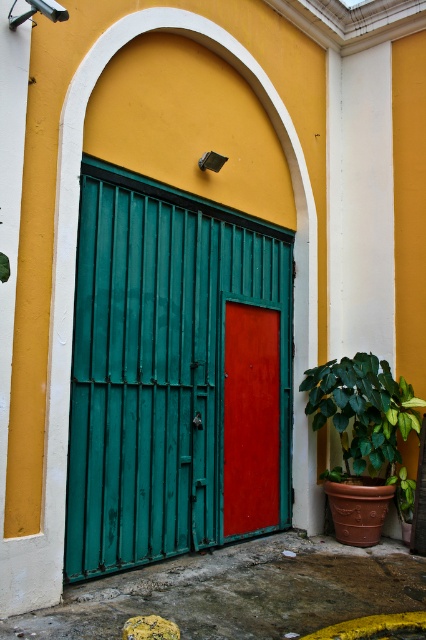
Question: Does green metal/glass door at center appear under green glossy leafy plant at lower right?

Choices:
 (A) yes
 (B) no

Answer: (B)

Question: Among these points, which one is nearest to the camera?

Choices:
 (A) (351, 452)
 (B) (176, 444)
 (C) (259, 445)

Answer: (B)

Question: Which point is closer to the camera?

Choices:
 (A) (241, 500)
 (B) (340, 477)
 (C) (256, 448)

Answer: (A)

Question: Based on their relative distances, which object is farther from the smooth glossy red door at center?

Choices:
 (A) green glossy leafy plant at lower right
 (B) green metal/glass door at center

Answer: (A)

Question: Is green metal/glass door at center to the right of smooth glossy red door at center from the viewer's perspective?

Choices:
 (A) no
 (B) yes

Answer: (A)

Question: Can you confirm if green metal/glass door at center is positioned to the left of green glossy leafy plant at lower right?

Choices:
 (A) yes
 (B) no

Answer: (A)